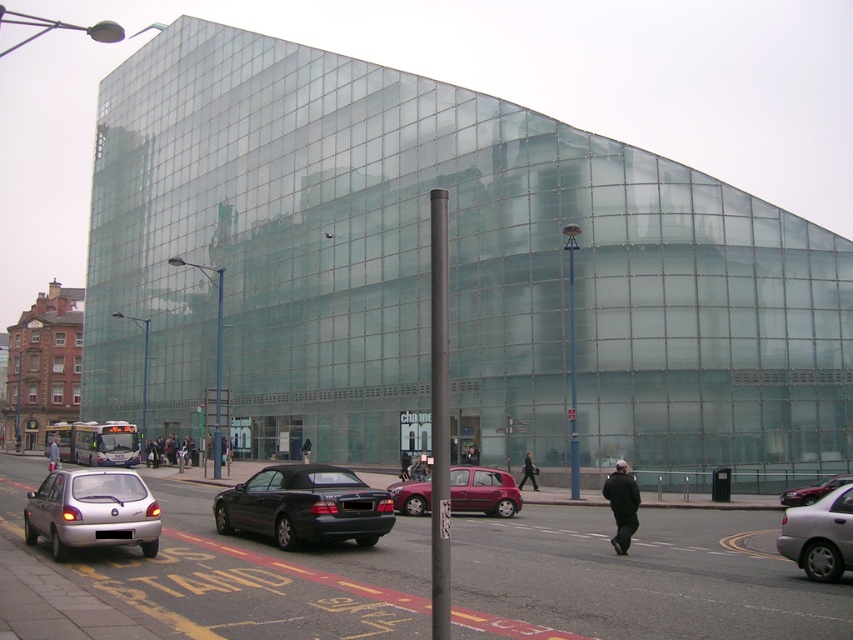
Can you confirm if silver metallic hatchback at lower left is positioned to the left of metallic silver car at lower right?

Indeed, silver metallic hatchback at lower left is positioned on the left side of metallic silver car at lower right.

Can you confirm if silver metallic hatchback at lower left is taller than metallic silver car at lower right?

No.

This screenshot has height=640, width=853. Find the location of `silver metallic hatchback at lower left`. silver metallic hatchback at lower left is located at coordinates (91, 512).

Is point (842, 541) positioned in front of point (828, 486)?

Yes, it is.

Is silver metallic sedan at lower right behind metallic silver car at lower right?

No, silver metallic sedan at lower right is in front of metallic silver car at lower right.

Which is in front, point (850, 484) or point (851, 477)?

Positioned in front is point (850, 484).

Identify the location of silver metallic sedan at lower right. The width and height of the screenshot is (853, 640). (819, 536).

Is shiny black convertible at center to the right of silver metallic sedan at lower right from the viewer's perspective?

No, shiny black convertible at center is not to the right of silver metallic sedan at lower right.

This screenshot has height=640, width=853. Find the location of `shiny black convertible at center`. shiny black convertible at center is located at coordinates (305, 506).